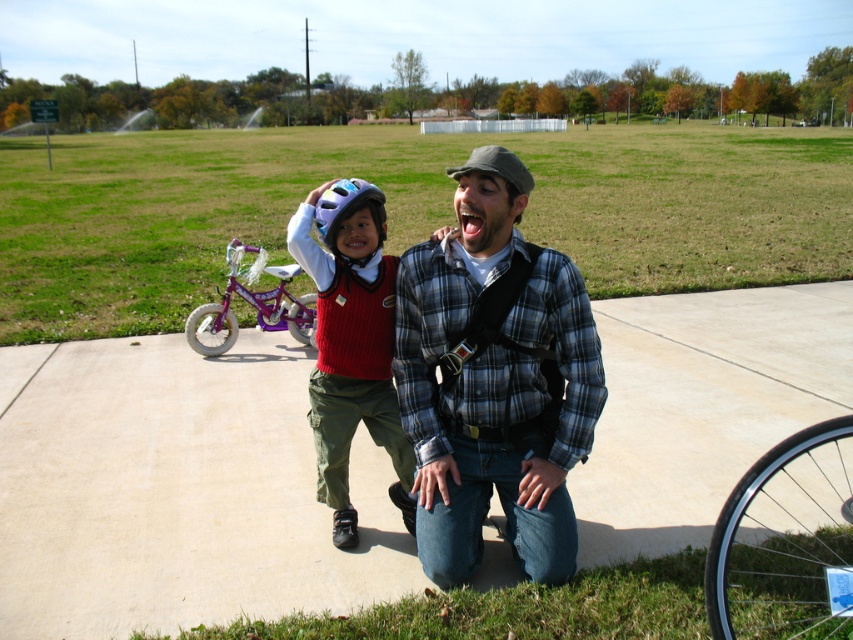
Question: Which point appears closest to the camera in this image?

Choices:
 (A) (323, 209)
 (B) (815, 630)

Answer: (B)

Question: Which object is the closest to the concrete at center?

Choices:
 (A) white matte bicycle helmet at center
 (B) plaid flannel shirt at center
 (C) matte white helmet at center
 (D) purple metallic bicycle at center-left

Answer: (C)

Question: Which point is farther to the camera?

Choices:
 (A) (527, 269)
 (B) (341, 212)

Answer: (B)

Question: Does concrete at center come behind matte white helmet at center?

Choices:
 (A) yes
 (B) no

Answer: (A)

Question: Observing the image, what is the correct spatial positioning of matte white helmet at center in reference to white matte bicycle helmet at center?

Choices:
 (A) left
 (B) right

Answer: (A)

Question: Is plaid flannel shirt at center above black rubber tire at lower right?

Choices:
 (A) yes
 (B) no

Answer: (A)